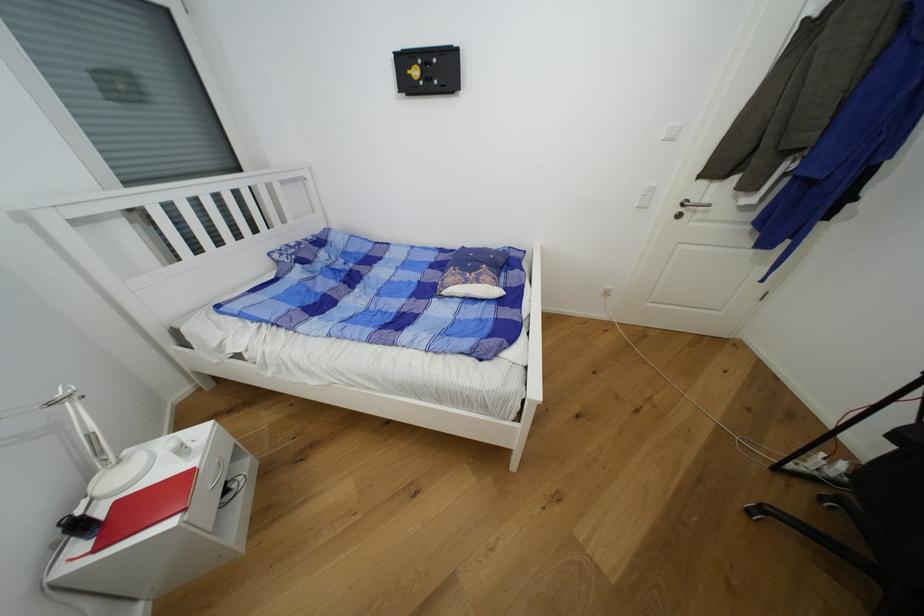
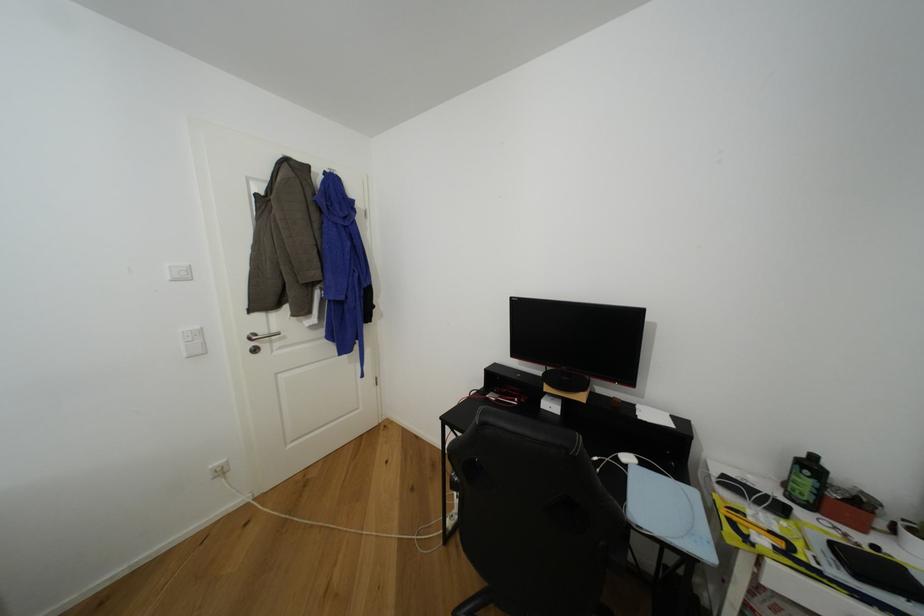
Find the pixel in the second image that matches (699,203) in the first image.

(268, 334)